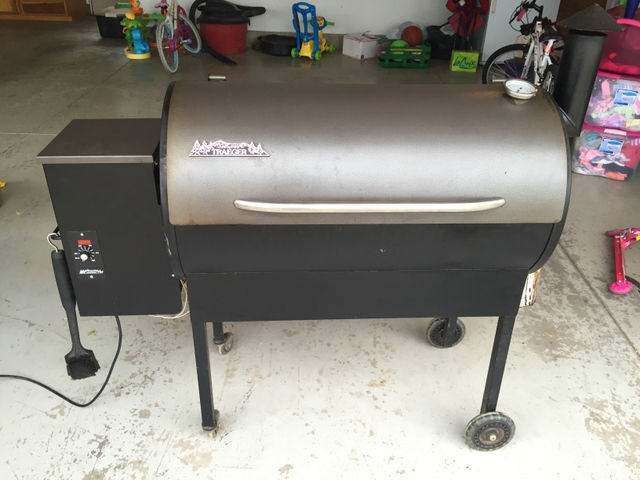
Identify the location of hook. (54, 239).